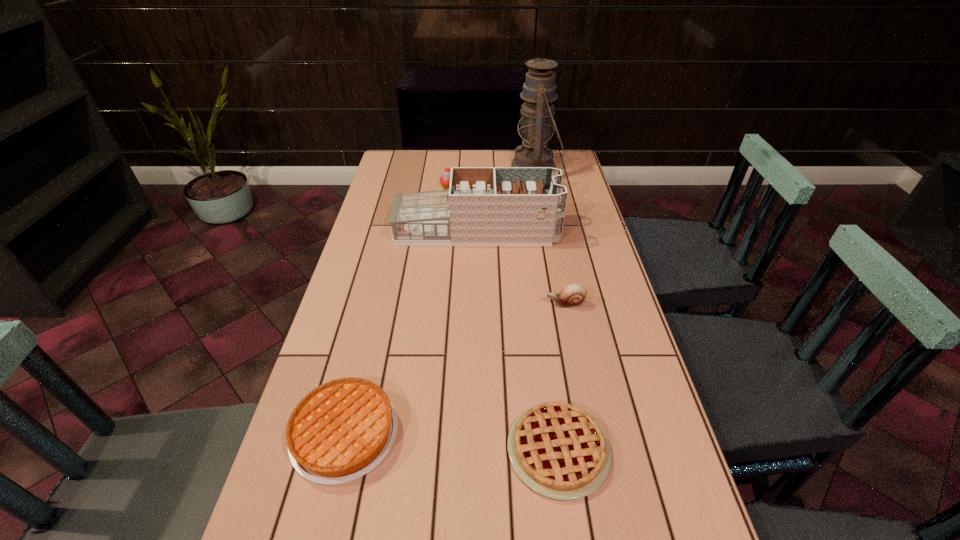
At what (x,y) coordinates should I click in order to perform the action: click on free space between the tallest object and the second shortest object. Please return your answer as a coordinate pair (x, y). The height and width of the screenshot is (540, 960). Looking at the image, I should click on (440, 300).

This screenshot has width=960, height=540. Find the location of `free spot between the third shortest object and the second shortest object`. free spot between the third shortest object and the second shortest object is located at coordinates (455, 368).

The height and width of the screenshot is (540, 960). What are the coordinates of `free spot between the shortest object and the tallest object` in the screenshot? It's located at (547, 308).

Image resolution: width=960 pixels, height=540 pixels. I want to click on vacant point located between the dollhouse and the right pie, so pos(517,340).

The width and height of the screenshot is (960, 540). Find the location of `free area in between the dollhouse and the shorter pie`. free area in between the dollhouse and the shorter pie is located at coordinates (517, 340).

Identify the location of empty space between the left pie and the cupcake. (396, 310).

The width and height of the screenshot is (960, 540). I want to click on empty space that is in between the cupcake and the taller pie, so click(x=396, y=310).

Find the location of a particular element. Image resolution: width=960 pixels, height=540 pixels. vacant region between the tallest object and the shortest object is located at coordinates (547, 308).

Locate an element on the screen. This screenshot has width=960, height=540. object that can be found as the fifth closest to the cupcake is located at coordinates (558, 450).

Where is `object that is the closest to the right pie`? The image size is (960, 540). object that is the closest to the right pie is located at coordinates (341, 430).